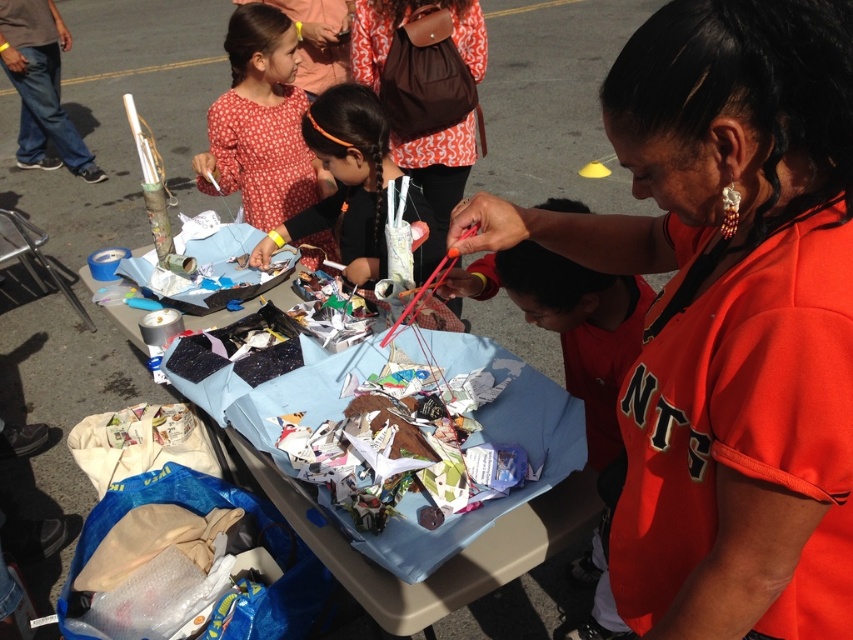
Question: Which object appears farthest from the camera in this image?

Choices:
 (A) matte black hair at center
 (B) red dotted blouse at upper left
 (C) jeans at left
 (D) orange jersey at center

Answer: (C)

Question: Is orange jersey at center bigger than red dotted blouse at upper left?

Choices:
 (A) yes
 (B) no

Answer: (B)

Question: Does blue fabric table at center have a greater width compared to matte black hair at center?

Choices:
 (A) no
 (B) yes

Answer: (A)

Question: Which point is farther from the camera taking this photo?

Choices:
 (A) (363, 401)
 (B) (683, 378)

Answer: (A)

Question: Can you confirm if crinkled paper scraps at center is positioned above matte black hair at center?

Choices:
 (A) yes
 (B) no

Answer: (B)

Question: Which of the following is the farthest from the observer?

Choices:
 (A) (776, 35)
 (B) (254, 33)

Answer: (B)